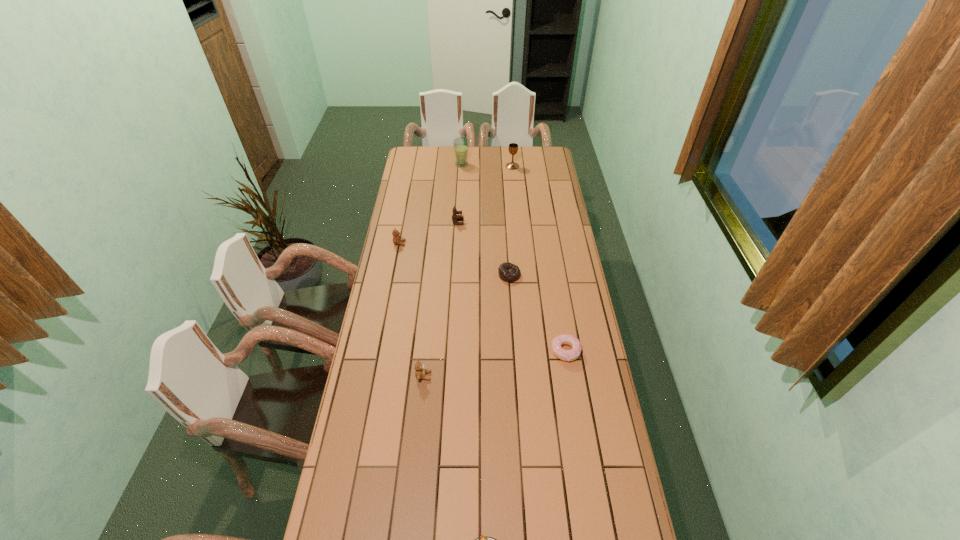
Locate an element on the screen. This screenshot has height=540, width=960. object that is at the left edge is located at coordinates (397, 240).

Locate an element on the screen. object at the right edge is located at coordinates (566, 355).

In the image, there is a desktop. Identify the location of free space at the far edge. (479, 163).

At what (x,y) coordinates should I click in order to perform the action: click on free point at the left edge. Please return your answer as a coordinate pair (x, y). The image size is (960, 540). Looking at the image, I should click on (425, 219).

Locate an element on the screen. vacant area at the right edge is located at coordinates (540, 178).

Locate an element on the screen. vacant space at the far right corner of the desktop is located at coordinates (544, 153).

Where is `blank region between the second teddy bear from left to right and the sixth farthest object`? Image resolution: width=960 pixels, height=540 pixels. blank region between the second teddy bear from left to right and the sixth farthest object is located at coordinates (494, 363).

The height and width of the screenshot is (540, 960). What are the coordinates of `empty space between the second teddy bear from right to left and the farthest teddy bear` in the screenshot? It's located at (441, 299).

Image resolution: width=960 pixels, height=540 pixels. Find the location of `blank region between the sixth nearest object and the beanbag`. blank region between the sixth nearest object and the beanbag is located at coordinates (484, 248).

Where is `free space that is in between the seventh object from right to left and the second farthest teddy bear`? Image resolution: width=960 pixels, height=540 pixels. free space that is in between the seventh object from right to left and the second farthest teddy bear is located at coordinates (412, 309).